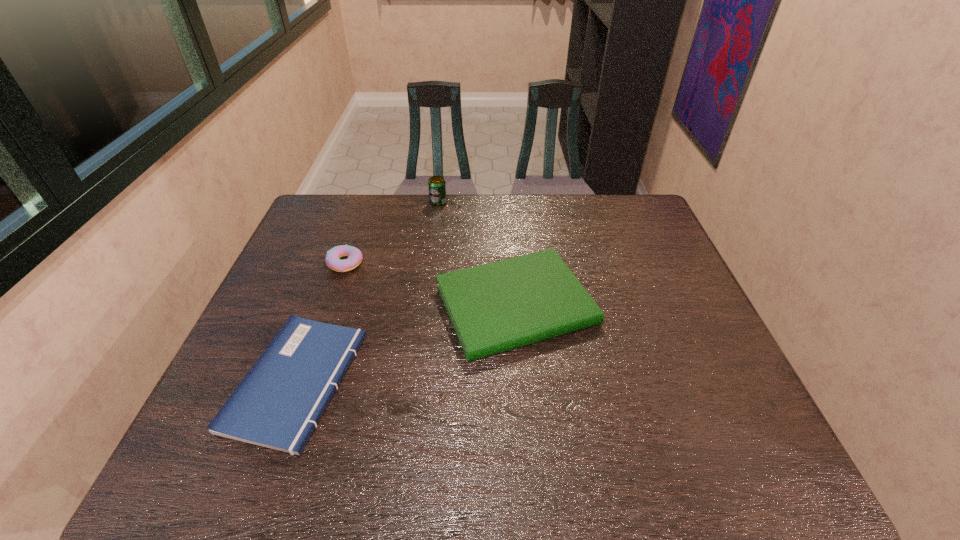
Locate an element on the screen. This screenshot has height=540, width=960. the farthest object is located at coordinates click(436, 185).

At what (x,y) coordinates should I click in order to perform the action: click on the tallest object. Please return your answer as a coordinate pair (x, y). Looking at the image, I should click on (436, 185).

I want to click on the right paperback book, so click(495, 307).

I want to click on doughnut, so click(x=354, y=255).

The width and height of the screenshot is (960, 540). Find the location of `the left paperback book`. the left paperback book is located at coordinates (278, 404).

Image resolution: width=960 pixels, height=540 pixels. What are the coordinates of `the shorter paperback book` in the screenshot? It's located at [x=278, y=404].

This screenshot has width=960, height=540. I want to click on vacant region located 0.050m on the right of the tallest object, so click(461, 202).

Image resolution: width=960 pixels, height=540 pixels. I want to click on vacant area situated 0.080m on the left of the taller paperback book, so click(405, 305).

Identify the location of free spot located 0.320m on the back of the doughnut. (369, 197).

At what (x,y) coordinates should I click in order to perform the action: click on free location located 0.090m on the right of the left paperback book. Please return your answer as a coordinate pair (x, y). Looking at the image, I should click on (396, 381).